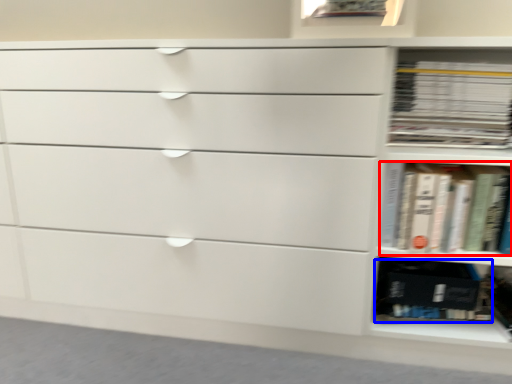
Question: Which object is further to the camera taking this photo, book (highlighted by a red box) or paperback book (highlighted by a blue box)?

Choices:
 (A) book
 (B) paperback book

Answer: (B)